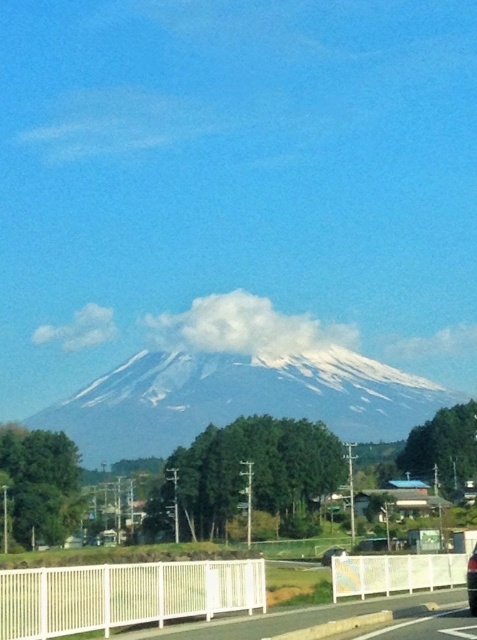
Question: Can you confirm if white snow-covered mountain at center is smaller than metallic silver car at center?

Choices:
 (A) yes
 (B) no

Answer: (B)

Question: Can you confirm if white snow-covered mountain at center is positioned above metallic silver car at center?

Choices:
 (A) no
 (B) yes

Answer: (A)

Question: Can you confirm if white snow-covered mountain at center is positioned to the right of metallic silver car at center?

Choices:
 (A) yes
 (B) no

Answer: (B)

Question: Which point is closer to the camera?

Choices:
 (A) (354, 413)
 (B) (467, 596)

Answer: (B)